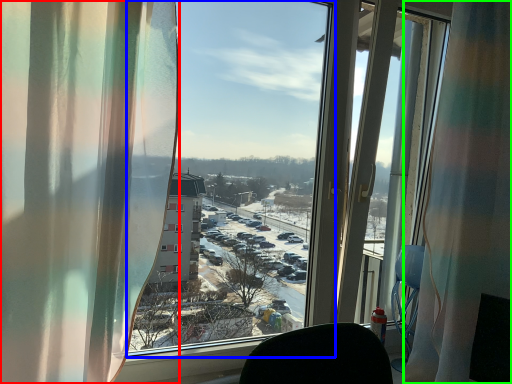
Question: Considering the real-world distances, which object is closest to curtain (highlighted by a red box)? window screen (highlighted by a blue box) or curtain (highlighted by a green box).

Choices:
 (A) window screen
 (B) curtain

Answer: (B)